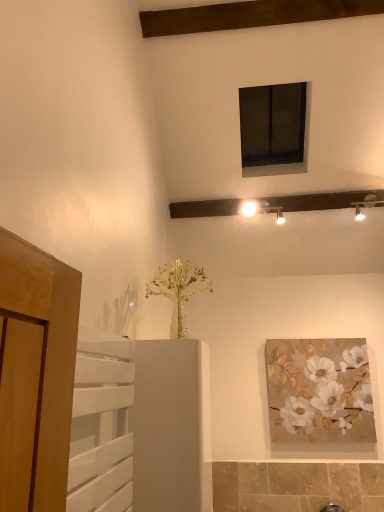
Where is `white painted flowers at upper right`? This screenshot has width=384, height=512. white painted flowers at upper right is located at coordinates (319, 390).

What do you see at coordinates (319, 390) in the screenshot? This screenshot has width=384, height=512. I see `white painted flowers at upper right` at bounding box center [319, 390].

The width and height of the screenshot is (384, 512). I want to click on white painted flowers at upper right, so click(319, 390).